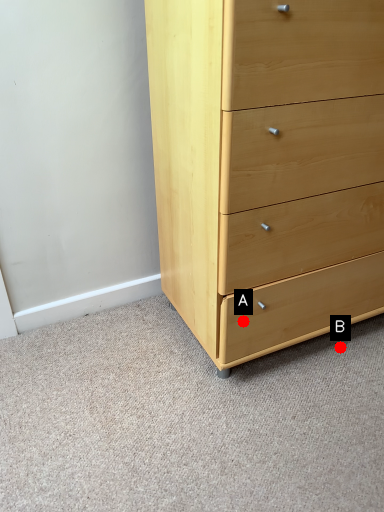
Question: Two points are circled on the image, labeled by A and B beside each circle. Which point is closer to the camera taking this photo?

Choices:
 (A) A is closer
 (B) B is closer

Answer: (A)